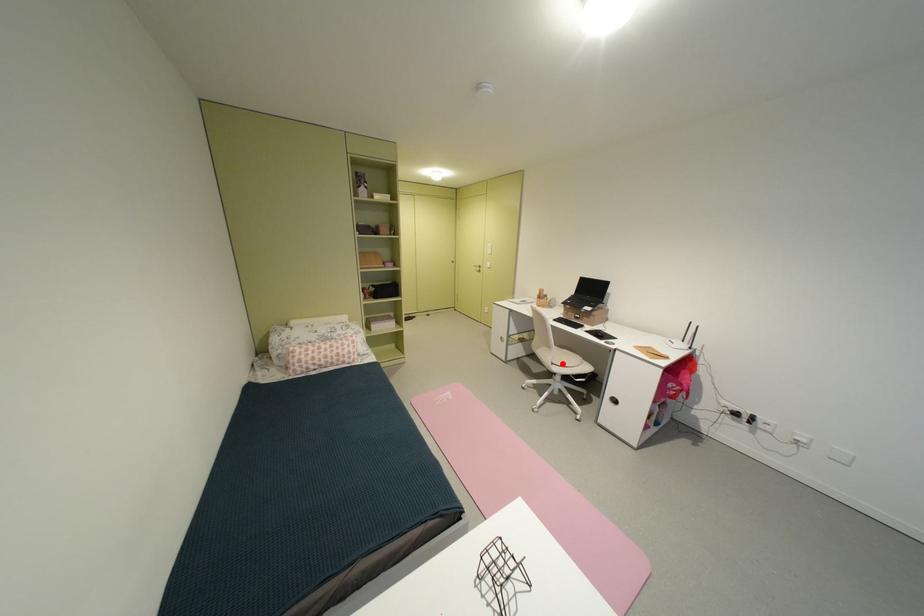
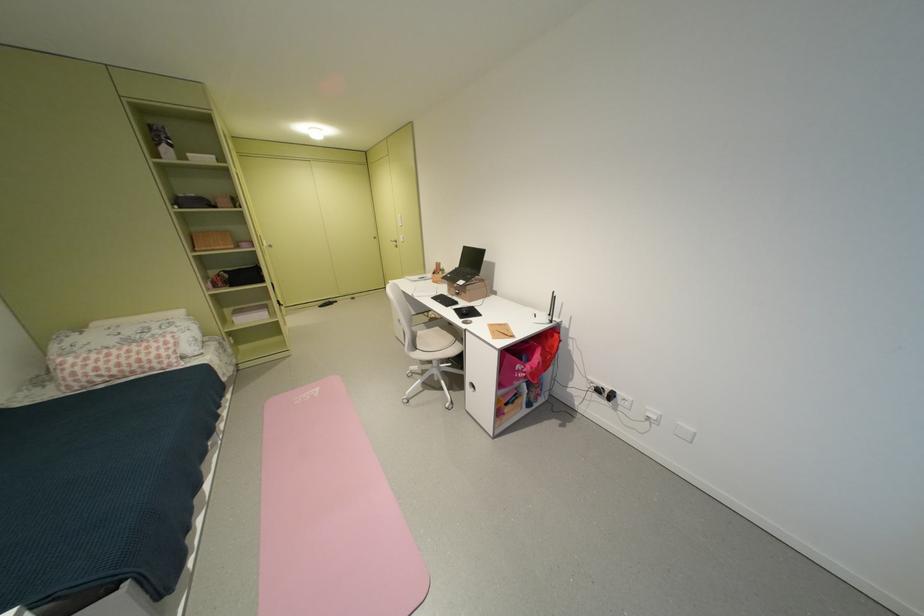
Question: I am providing you with two images of the same scene from different viewpoints. A red point is shown in image1. For the corresponding object point in image2, is it positioned nearer or farther from the camera?

Choices:
 (A) Nearer
 (B) Farther

Answer: (B)